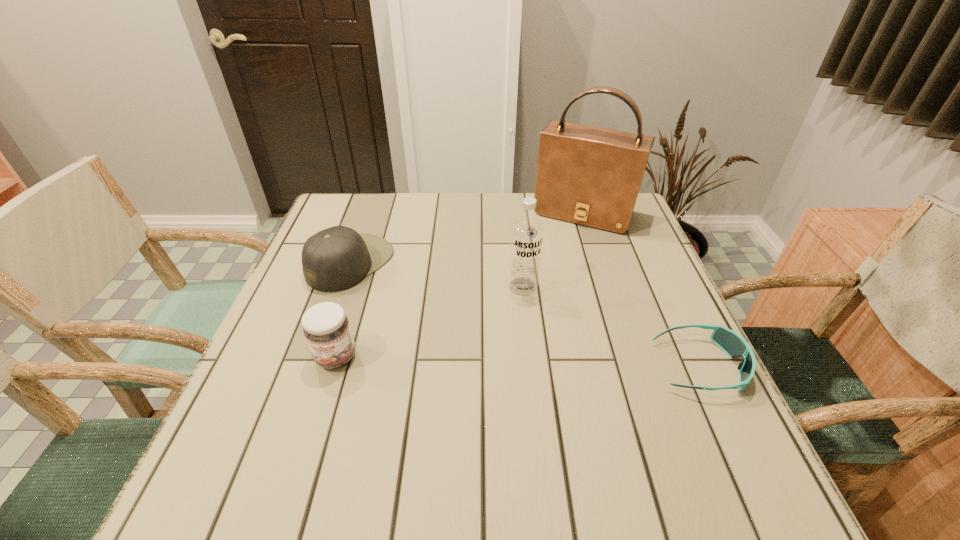
At what (x,y) coordinates should I click in order to perform the action: click on vacant space on the desktop that is between the jam and the sunglasses and is positioned on the front flap of the shoulder bag. Please return your answer as a coordinate pair (x, y). This screenshot has width=960, height=540. Looking at the image, I should click on click(x=513, y=361).

Locate an element on the screen. vacant space on the desktop that is between the jam and the shortest object and is positioned on the front label of the vodka is located at coordinates click(509, 361).

This screenshot has width=960, height=540. Find the location of `free space on the desktop that is between the jam and the shortest object and is positioned on the brim of the cap`. free space on the desktop that is between the jam and the shortest object and is positioned on the brim of the cap is located at coordinates (568, 363).